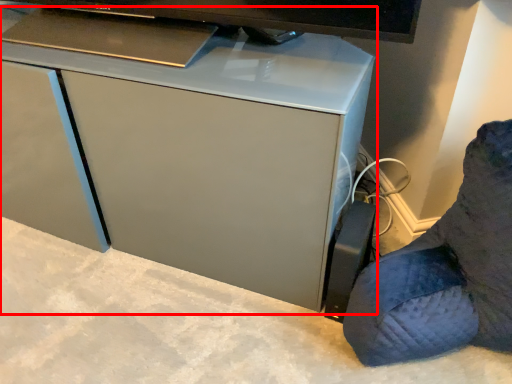
Question: From the image's perspective, where is computer desk (annotated by the red box) located relative to furniture?

Choices:
 (A) above
 (B) below

Answer: (A)